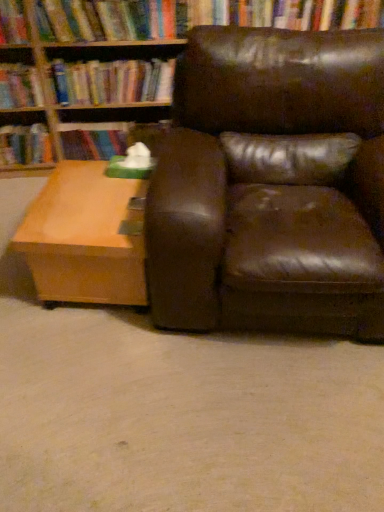
Locate an element on the screen. Image resolution: width=384 pixels, height=512 pixels. free space above hardcover book at center, the 3th book when ordered from left to right (from a real-world perspective) is located at coordinates (102, 127).